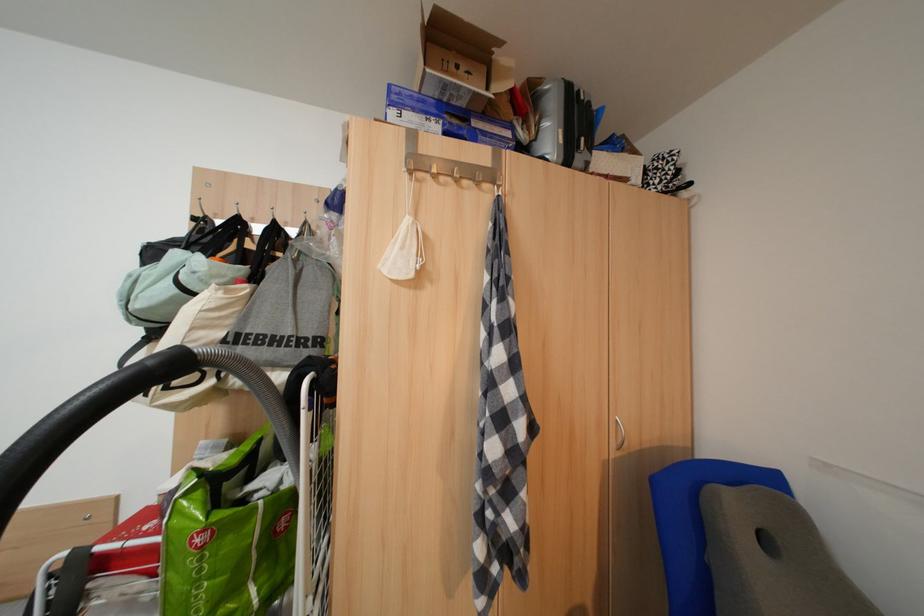
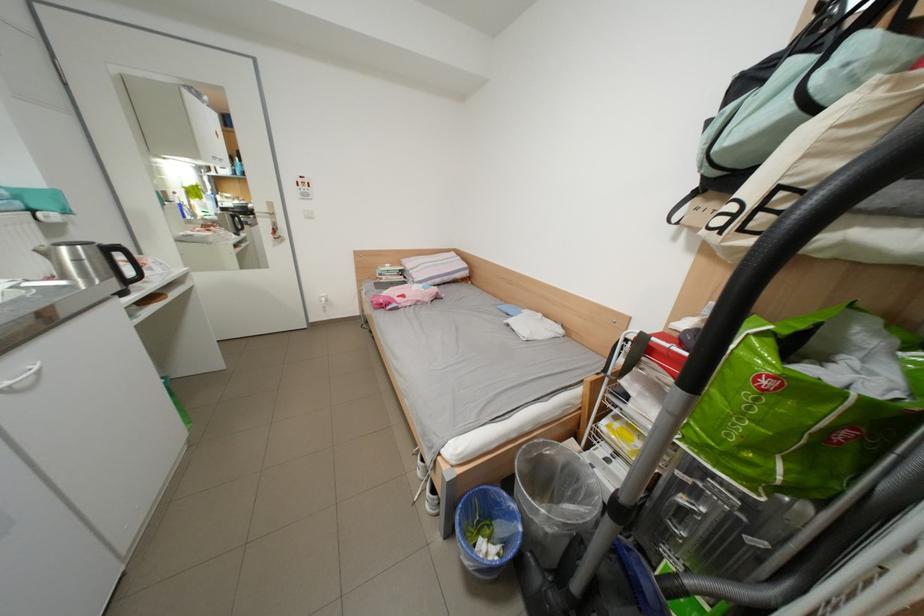
Locate, in the second image, the point that corresponds to pixel 241 323 in the first image.

(877, 146)